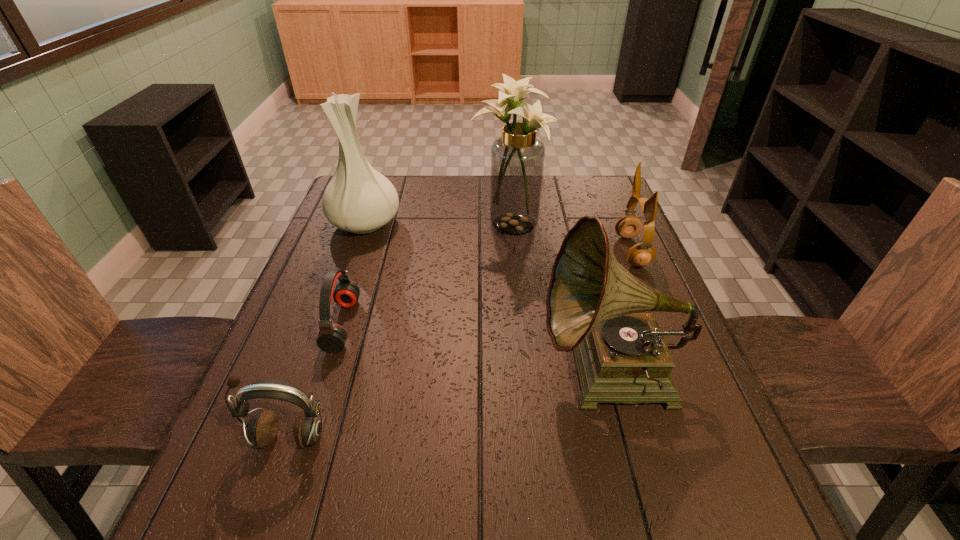
The image size is (960, 540). What are the coordinates of `vase present at the far edge` in the screenshot? It's located at (358, 199).

Locate an element on the screen. The image size is (960, 540). vase present at the left edge is located at coordinates (358, 199).

What are the coordinates of `record player positioned at the right edge` in the screenshot? It's located at pyautogui.click(x=593, y=303).

You are a GUI agent. You are given a task and a screenshot of the screen. Output one action in this format:
    pyautogui.click(x=<x>, y=<y>)
    Task: Click on the earphone that is at the right edge
    This screenshot has height=540, width=960.
    Given the screenshot: What is the action you would take?
    pyautogui.click(x=629, y=226)

At what (x,y) coordinates should I click in order to perform the action: click on object positioned at the far left corner. Please return your answer as a coordinate pair (x, y). Looking at the image, I should click on (358, 199).

Locate an element on the screen. This screenshot has width=960, height=540. free spot at the far edge of the desktop is located at coordinates (559, 183).

Where is `vacant space at the near edge of the desktop`? The width and height of the screenshot is (960, 540). vacant space at the near edge of the desktop is located at coordinates (406, 516).

In the image, there is a desktop. Where is `vacant space at the left edge`? The image size is (960, 540). vacant space at the left edge is located at coordinates (333, 377).

Find the location of a particular element. free space at the far right corner of the desktop is located at coordinates (617, 214).

This screenshot has height=540, width=960. What are the coordinates of `free space between the record player and the shortest earphone` in the screenshot? It's located at (476, 349).